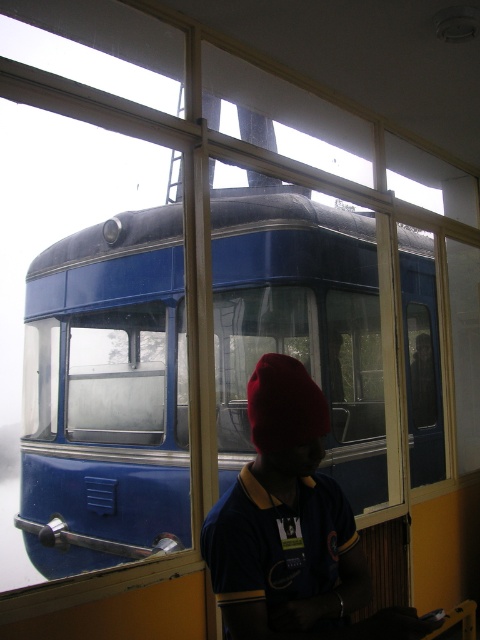
Question: Does blue metallic tram at center have a greater width compared to matte red beanie at center?

Choices:
 (A) yes
 (B) no

Answer: (A)

Question: Among these objects, which one is nearest to the camera?

Choices:
 (A) blue metallic tram at center
 (B) matte red beanie at center

Answer: (B)

Question: Is blue metallic tram at center to the left of matte red beanie at center from the viewer's perspective?

Choices:
 (A) no
 (B) yes

Answer: (B)

Question: Is blue metallic tram at center to the left of matte red beanie at center from the viewer's perspective?

Choices:
 (A) yes
 (B) no

Answer: (A)

Question: Which object appears closest to the camera in this image?

Choices:
 (A) blue metallic tram at center
 (B) matte red beanie at center

Answer: (B)

Question: Which point is closer to the camera taking this photo?

Choices:
 (A) (24, 426)
 (B) (300, 602)

Answer: (B)